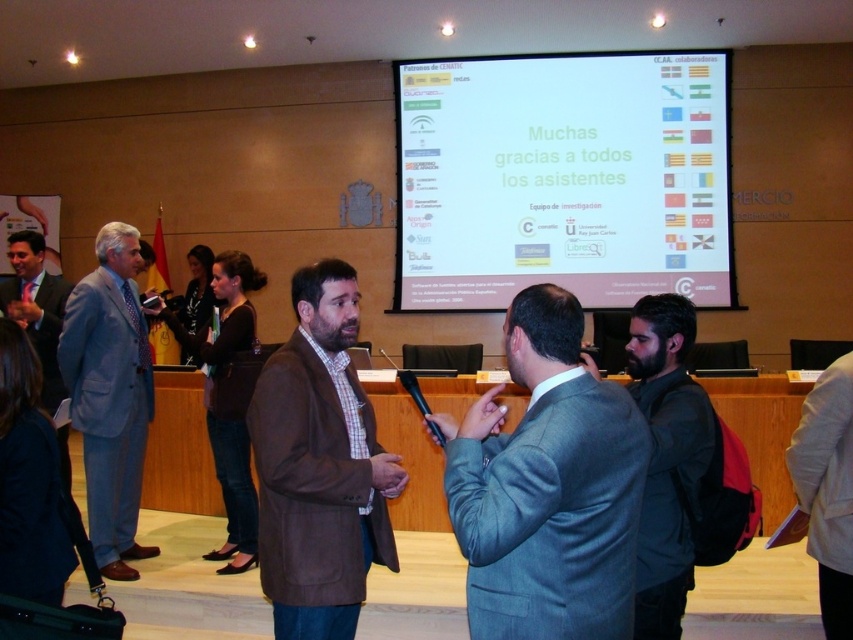
Who is positioned more to the left, white matte projection screen at upper center or brown woolen jacket at center?

brown woolen jacket at center is more to the left.

Does white matte projection screen at upper center have a smaller size compared to brown woolen jacket at center?

No, white matte projection screen at upper center is not smaller than brown woolen jacket at center.

Which is in front, point (479, 77) or point (306, 296)?

Point (306, 296)

The image size is (853, 640). Find the location of `white matte projection screen at upper center`. white matte projection screen at upper center is located at coordinates (561, 179).

Is brown woolen jacket at center closer to camera compared to matte black suit at left?

Yes.

Locate an element on the screen. The height and width of the screenshot is (640, 853). brown woolen jacket at center is located at coordinates (318, 465).

Locate an element on the screen. The height and width of the screenshot is (640, 853). brown woolen jacket at center is located at coordinates (318, 465).

Does brown woolen jacket at center come behind gray fabric jacket at lower right?

No, it is in front of gray fabric jacket at lower right.

Is brown woolen jacket at center smaller than gray fabric jacket at lower right?

No.

Does point (311, 342) come closer to viewer compared to point (798, 458)?

Yes.

I want to click on brown woolen jacket at center, so click(318, 465).